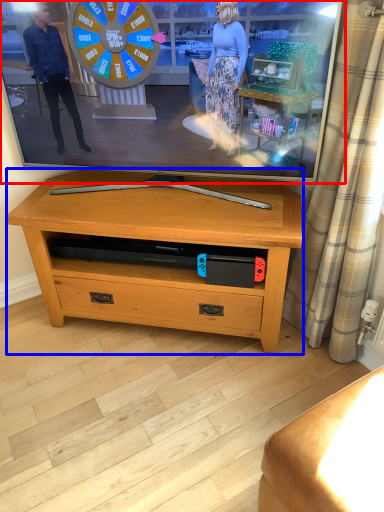
Question: Which object appears closest to the camera in this image, television (highlighted by a red box) or table (highlighted by a blue box)?

Choices:
 (A) television
 (B) table

Answer: (A)